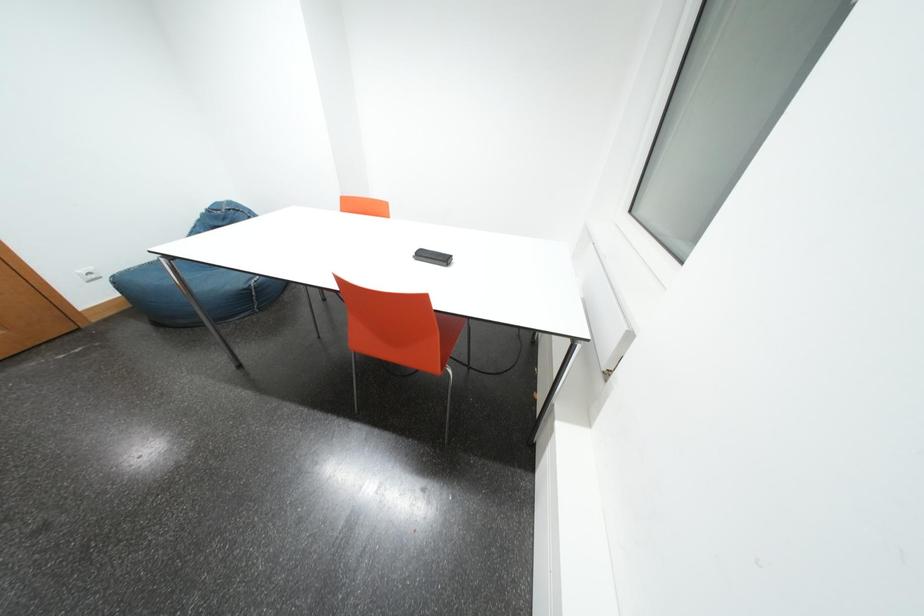
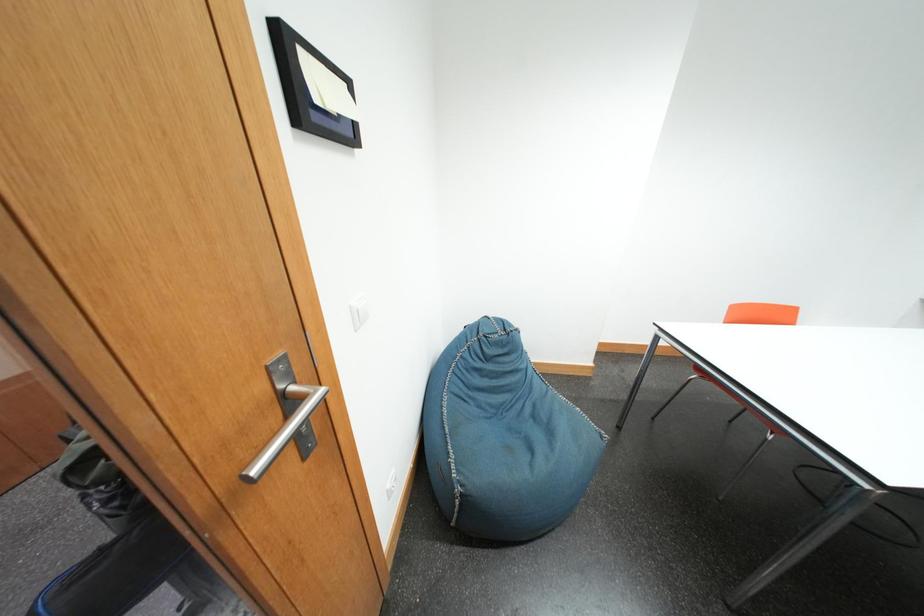
Question: What movement of the cameraman would produce the second image?

Choices:
 (A) Left
 (B) Right
 (C) Forward
 (D) Backward

Answer: (A)